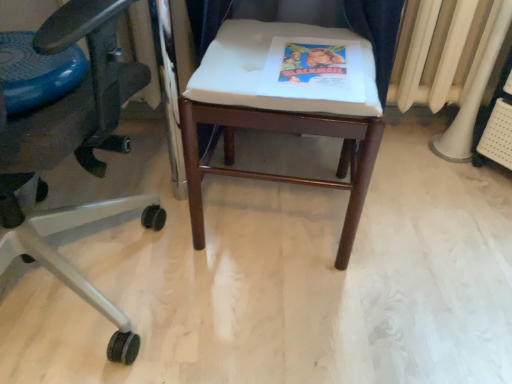
Locate an element on the screen. Image resolution: width=512 pixels, height=384 pixels. free space in front of white plastic radiator at right is located at coordinates (469, 183).